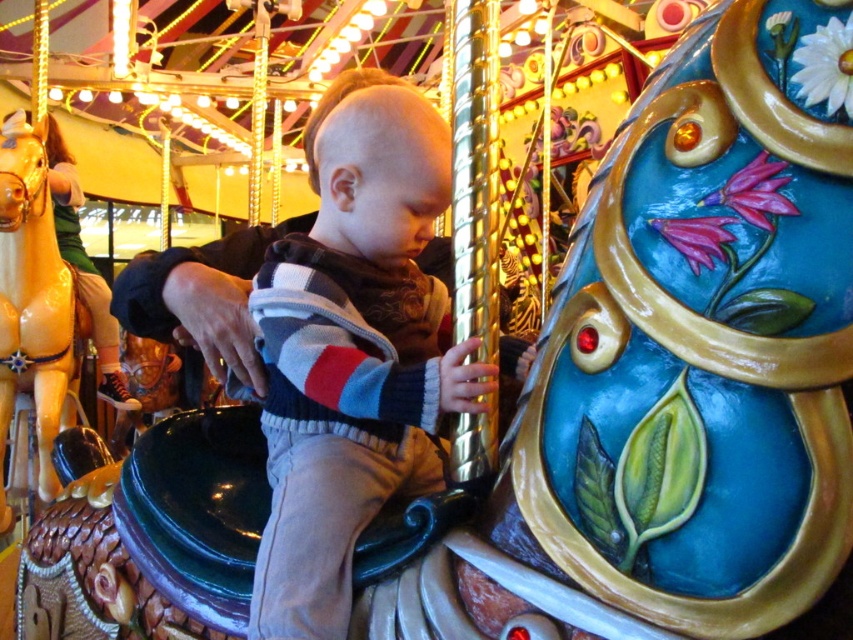
Question: Can you confirm if striped sweater at center is thinner than shiny gold horse at left?

Choices:
 (A) no
 (B) yes

Answer: (A)

Question: Which of the following is the closest to the observer?

Choices:
 (A) shiny gold horse at left
 (B) striped sweater at center

Answer: (B)

Question: Can you confirm if striped sweater at center is positioned above shiny gold horse at left?

Choices:
 (A) no
 (B) yes

Answer: (A)

Question: Is striped sweater at center closer to camera compared to shiny gold horse at left?

Choices:
 (A) yes
 (B) no

Answer: (A)

Question: Which object appears farthest from the camera in this image?

Choices:
 (A) striped sweater at center
 (B) shiny gold horse at left

Answer: (B)